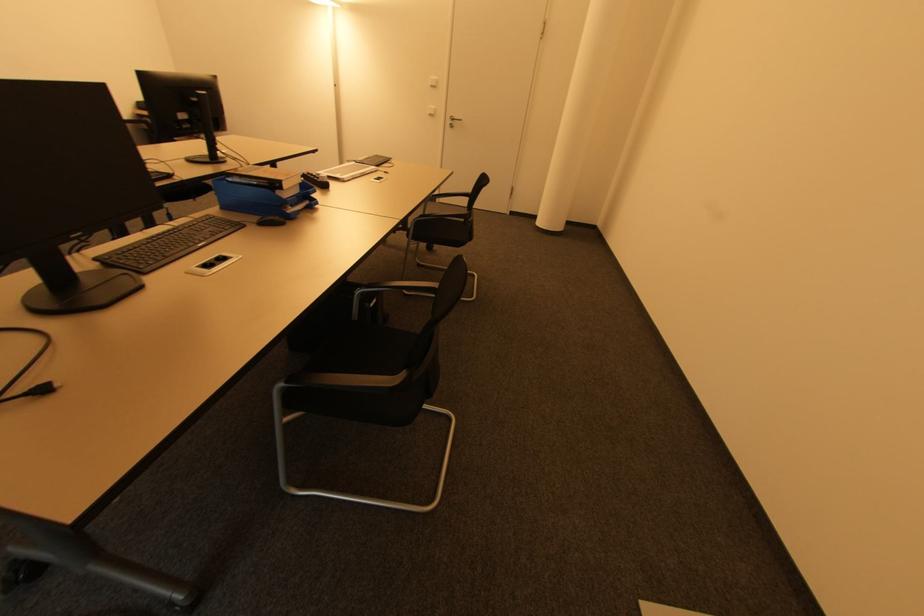
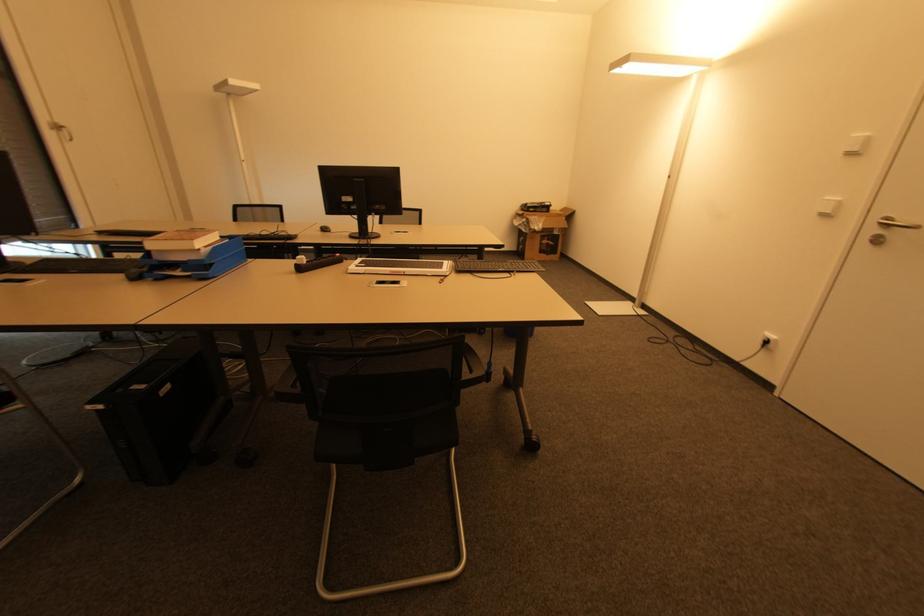
Locate, in the second image, the point that corresponds to point 455,118 in the first image.

(890, 221)